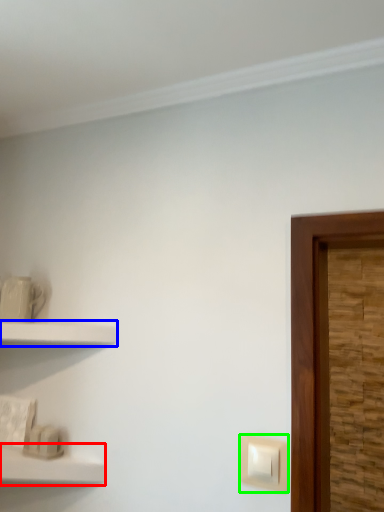
Question: Which is farther away from shelf (highlighted by a red box)? shelf (highlighted by a blue box) or light switch (highlighted by a green box)?

Choices:
 (A) shelf
 (B) light switch

Answer: (B)